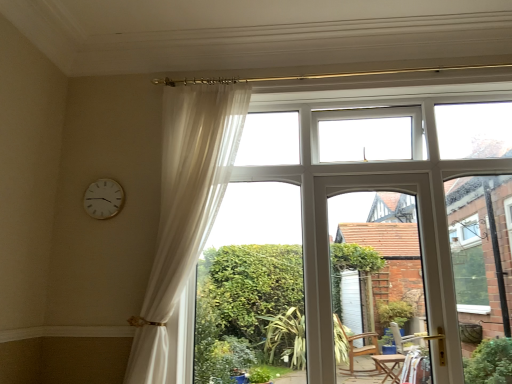
Measure the distance between white plastic clock at upper left and camera.

white plastic clock at upper left is 2.57 meters away from camera.

Identify the location of white plastic clock at upper left. This screenshot has height=384, width=512. (103, 199).

Image resolution: width=512 pixels, height=384 pixels. Describe the element at coordinates (103, 199) in the screenshot. I see `white plastic clock at upper left` at that location.

You are a GUI agent. You are given a task and a screenshot of the screen. Output one action in this format:
    pyautogui.click(x=<x>, y=<y>)
    Task: Click on the white plastic clock at upper left
    This screenshot has height=384, width=512.
    Given the screenshot: What is the action you would take?
    pyautogui.click(x=103, y=199)